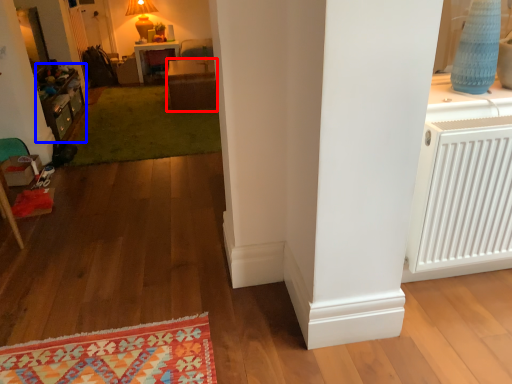
Question: Which of the following is the closest to the observer, table (highlighted by a red box) or dresser (highlighted by a blue box)?

Choices:
 (A) table
 (B) dresser

Answer: (B)